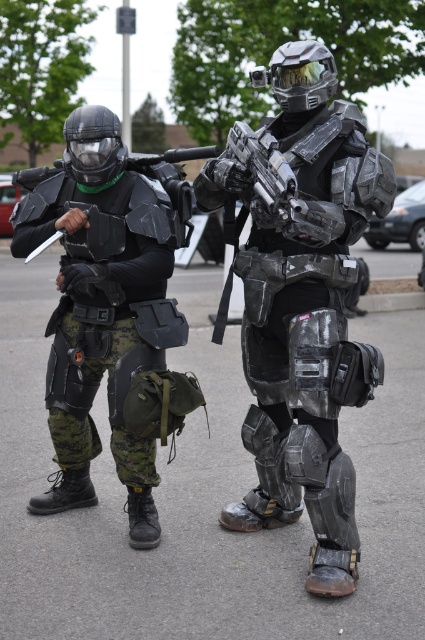
Is the position of shiny metallic armor at center more distant than that of matte black armor at left?

That is False.

Who is shorter, shiny metallic armor at center or matte black armor at left?

matte black armor at left

Between point (288, 356) and point (73, 273), which one is positioned behind?

The point (288, 356) is behind.

You are a GUI agent. You are given a task and a screenshot of the screen. Output one action in this format:
    pyautogui.click(x=<x>, y=<y>)
    Task: Click on the shiny metallic armor at center
    The image size is (425, 640).
    Given the screenshot: What is the action you would take?
    pos(302,300)

Which is above, shiny metallic armor at center or shiny metallic gun at center?

shiny metallic gun at center

Looking at this image, is shiny metallic armor at center positioned behind shiny metallic gun at center?

No, it is in front of shiny metallic gun at center.

Which is behind, point (294, 268) or point (201, 195)?

Point (201, 195)

The width and height of the screenshot is (425, 640). What are the coordinates of `shiny metallic armor at center` in the screenshot? It's located at (302, 300).

Does point (161, 209) come closer to viewer compared to point (283, 184)?

No, it is not.

Is matte black armor at left taller than shiny metallic gun at center?

Correct, matte black armor at left is much taller as shiny metallic gun at center.

Does point (67, 177) lie in front of point (237, 182)?

No, (67, 177) is behind (237, 182).

This screenshot has width=425, height=640. Identify the location of matte black armor at left. (102, 308).